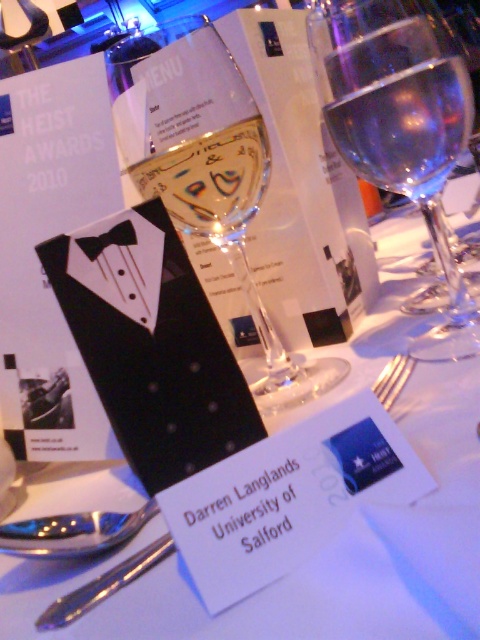
You are a server at the Heist Awards 2010. You need to place a dessert plate between the transparent glass wine glass at center and the transparent glass wine glass at upper center. Which glass should you position the dessert plate closer to to ensure it fits properly?

The transparent glass wine glass at center is wider than the transparent glass wine glass at upper center. Therefore, to ensure the dessert plate fits properly, you should position it closer to the transparent glass wine glass at upper center, which has a narrower width.

You are at the awards ceremony and want to grab a drink. Where is the transparent glass wine glass at center located in terms of coordinates?

The transparent glass wine glass at center is located at coordinates point (x=205, y=168).

You are a server at the Heist Awards 2010 event. You need to place a dessert plate between the transparent glass wine glass at center and the transparent glass at center. Which glass should the dessert plate be placed closer to, the one with the larger width or the smaller one?

The dessert plate should be placed closer to the transparent glass wine glass at center since its width is larger than the transparent glass at center, allowing more space for the plate.